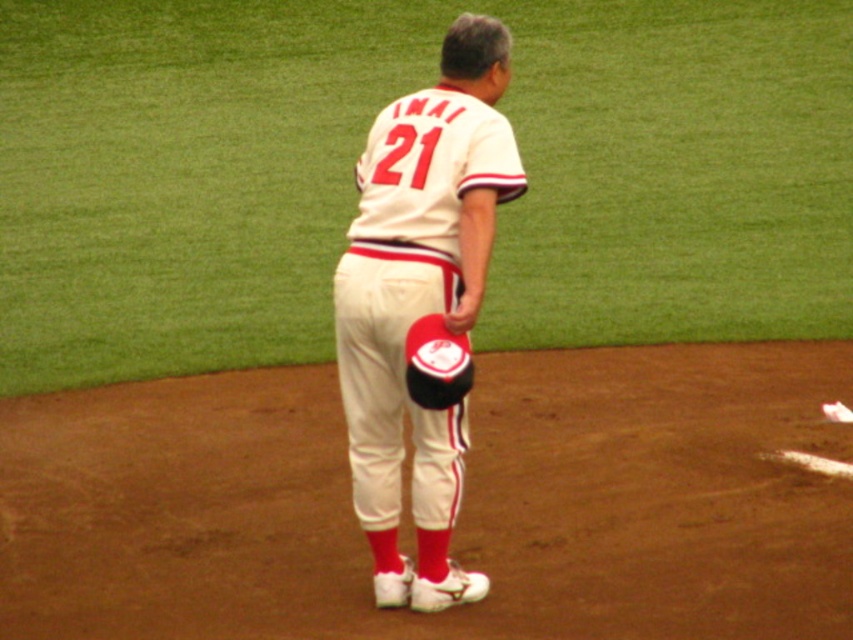
You are a baseball player standing on the dirt infield and you see two points marked on the field. The first point is at coordinates point (352,225) and the second point is at point (425,360). Which point is closer to you?

Point (352,225) is behind point (425,360), so the closer point to you is point (425,360).